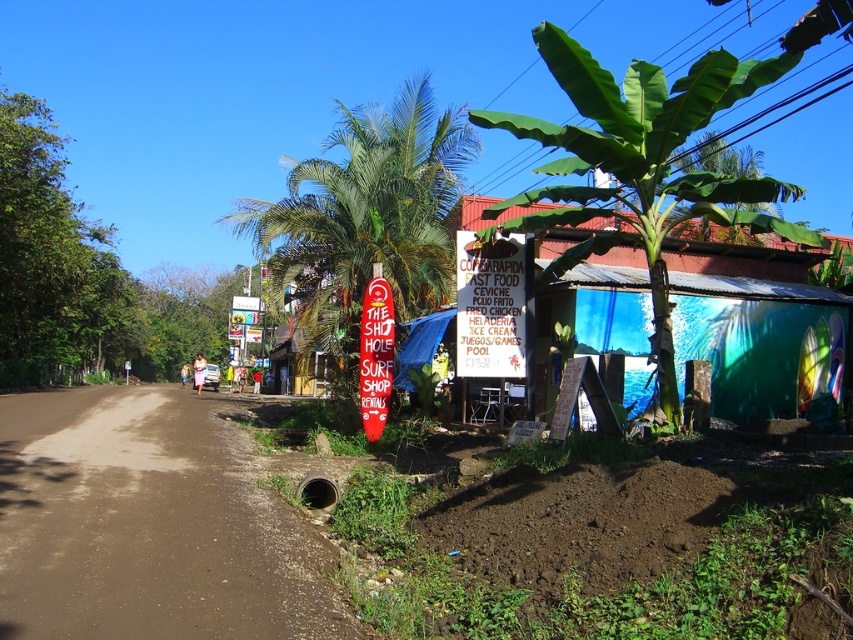
Question: Can you confirm if green leafy banana tree at center is positioned to the right of white paper sign at center?

Choices:
 (A) no
 (B) yes

Answer: (A)

Question: Among these points, which one is farthest from the camera?

Choices:
 (A) (434, 305)
 (B) (795, 186)
 (C) (250, 630)
 (D) (518, 284)

Answer: (A)

Question: Does brown dirt track at lower left have a larger size compared to green leafy banana tree at right?

Choices:
 (A) yes
 (B) no

Answer: (B)

Question: Where is brown dirt track at lower left located in relation to red plastic sign at center in the image?

Choices:
 (A) right
 (B) left

Answer: (B)

Question: Which of the following is the farthest from the observer?

Choices:
 (A) (320, 284)
 (B) (463, 310)
 (C) (375, 336)

Answer: (A)

Question: Which point is farther to the camera?

Choices:
 (A) brown dirt track at lower left
 (B) white paper sign at center

Answer: (B)